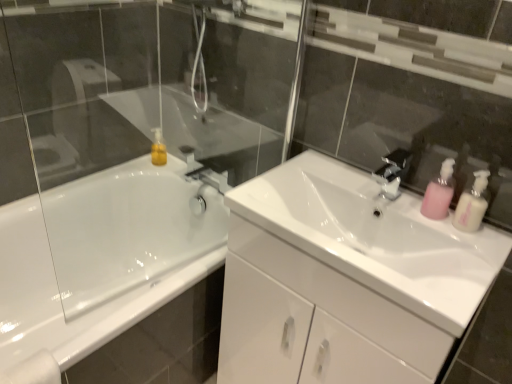
Question: Considering the positions of pink plastic soap dispenser at right, acting as the second soap dispenser starting from the right, and white glossy sink at center in the image, is pink plastic soap dispenser at right, acting as the second soap dispenser starting from the right, wider or thinner than white glossy sink at center?

Choices:
 (A) thin
 (B) wide

Answer: (A)

Question: In terms of size, does pink plastic soap dispenser at right, the 1th soap dispenser when ordered from left to right, appear bigger or smaller than white glossy sink at center?

Choices:
 (A) big
 (B) small

Answer: (B)

Question: Which is nearer to the white glossy bathtub at left?

Choices:
 (A) pink plastic soap dispenser at right, the second soap dispenser in the left-to-right sequence
 (B) white glossy sink at center
 (C) black metallic faucet at upper center
 (D) pink plastic soap dispenser at right, acting as the second soap dispenser starting from the right

Answer: (B)

Question: Estimate the real-world distances between objects in this image. Which object is farther from the pink plastic soap dispenser at right, acting as the second soap dispenser starting from the right?

Choices:
 (A) pink plastic soap dispenser at right, the second soap dispenser in the left-to-right sequence
 (B) white glossy bathtub at left
 (C) white glossy sink at center
 (D) black metallic faucet at upper center

Answer: (B)